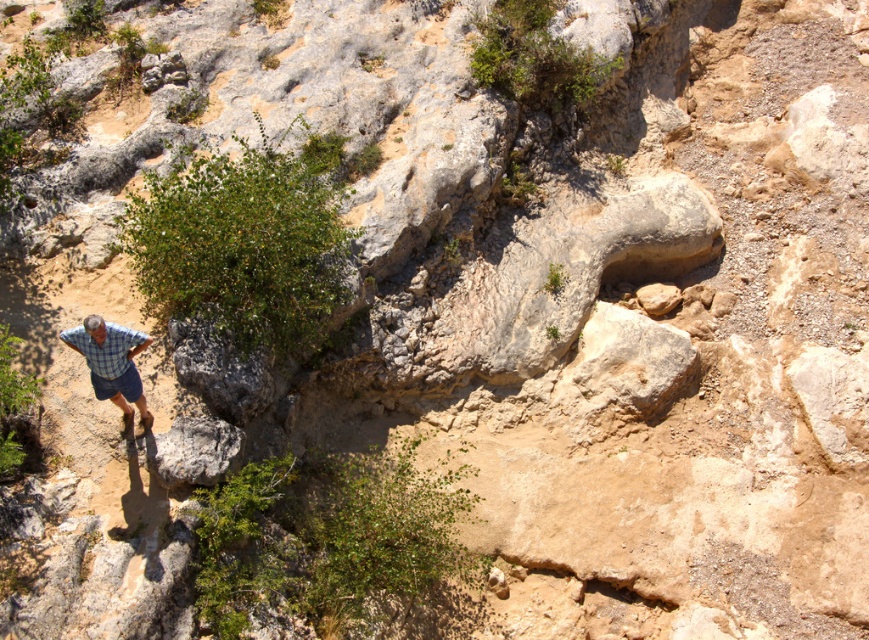
Which is behind, point (108, 353) or point (118, 380)?

The point (118, 380) is behind.

At what (x,y) coordinates should I click in order to perform the action: click on checkered fabric hiker at lower left. Please return your answer as a coordinate pair (x, y). This screenshot has height=640, width=869. Looking at the image, I should click on (111, 364).

Locate an element on the screen. The height and width of the screenshot is (640, 869). checkered fabric hiker at lower left is located at coordinates (111, 364).

Is gray rough rock at lower left wider than checkered fabric hiker at lower left?

Yes, gray rough rock at lower left is wider than checkered fabric hiker at lower left.

Does gray rough rock at lower left appear under checkered fabric hiker at lower left?

Yes, gray rough rock at lower left is below checkered fabric hiker at lower left.

Identify the location of gray rough rock at lower left. (194, 451).

Who is more distant from viewer, (207, 465) or (100, 385)?

The point (207, 465) is behind.

Can you confirm if gray rough rock at lower left is positioned below blue plaid shorts at lower left?

Indeed, gray rough rock at lower left is positioned under blue plaid shorts at lower left.

You are a GUI agent. You are given a task and a screenshot of the screen. Output one action in this format:
    pyautogui.click(x=<x>, y=<y>)
    Task: Click on the gray rough rock at lower left
    This screenshot has height=640, width=869.
    Given the screenshot: What is the action you would take?
    pyautogui.click(x=194, y=451)